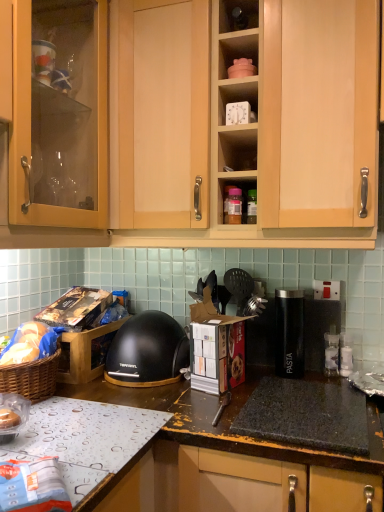
Question: From the image's perspective, is black granite gas stove at lower center located above clear plastic bag at lower left?

Choices:
 (A) no
 (B) yes

Answer: (A)

Question: Does black granite gas stove at lower center have a lesser width compared to clear plastic bag at lower left?

Choices:
 (A) no
 (B) yes

Answer: (A)

Question: Is black granite gas stove at lower center aimed at clear plastic bag at lower left?

Choices:
 (A) no
 (B) yes

Answer: (A)

Question: Can we say black granite gas stove at lower center lies outside clear plastic bag at lower left?

Choices:
 (A) yes
 (B) no

Answer: (A)

Question: Is the depth of black granite gas stove at lower center greater than that of clear plastic bag at lower left?

Choices:
 (A) no
 (B) yes

Answer: (B)

Question: Considering the relative sizes of black granite gas stove at lower center and clear plastic bag at lower left in the image provided, is black granite gas stove at lower center wider than clear plastic bag at lower left?

Choices:
 (A) yes
 (B) no

Answer: (A)

Question: Is matte plastic container at upper center, the first shelf positioned from the top, positioned far away from black plastic pasta container at center?

Choices:
 (A) no
 (B) yes

Answer: (A)

Question: Is matte plastic container at upper center, the first shelf positioned from the top, thinner than black plastic pasta container at center?

Choices:
 (A) yes
 (B) no

Answer: (B)

Question: From a real-world perspective, does matte plastic container at upper center, the first shelf positioned from the top, sit lower than black plastic pasta container at center?

Choices:
 (A) no
 (B) yes

Answer: (A)

Question: Does matte plastic container at upper center, which appears as the 2th shelf when ordered from the bottom, touch black plastic pasta container at center?

Choices:
 (A) yes
 (B) no

Answer: (B)

Question: Is matte plastic container at upper center, the first shelf positioned from the top, positioned before black plastic pasta container at center?

Choices:
 (A) no
 (B) yes

Answer: (B)

Question: From a real-world perspective, is matte plastic container at upper center, which appears as the 2th shelf when ordered from the bottom, on black plastic pasta container at center?

Choices:
 (A) yes
 (B) no

Answer: (A)

Question: Can you confirm if light wood cabinet at upper center is smaller than clear plastic bag at lower left?

Choices:
 (A) yes
 (B) no

Answer: (B)